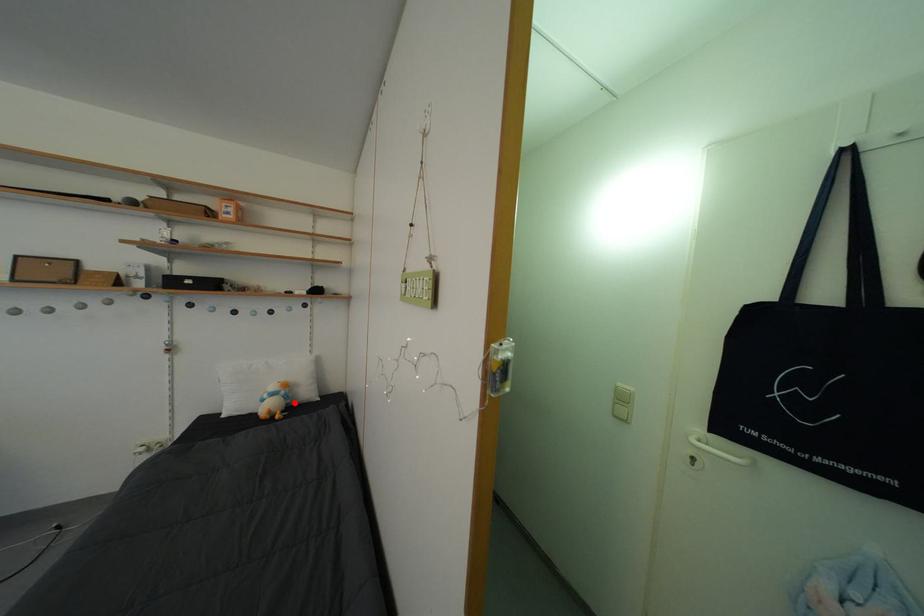
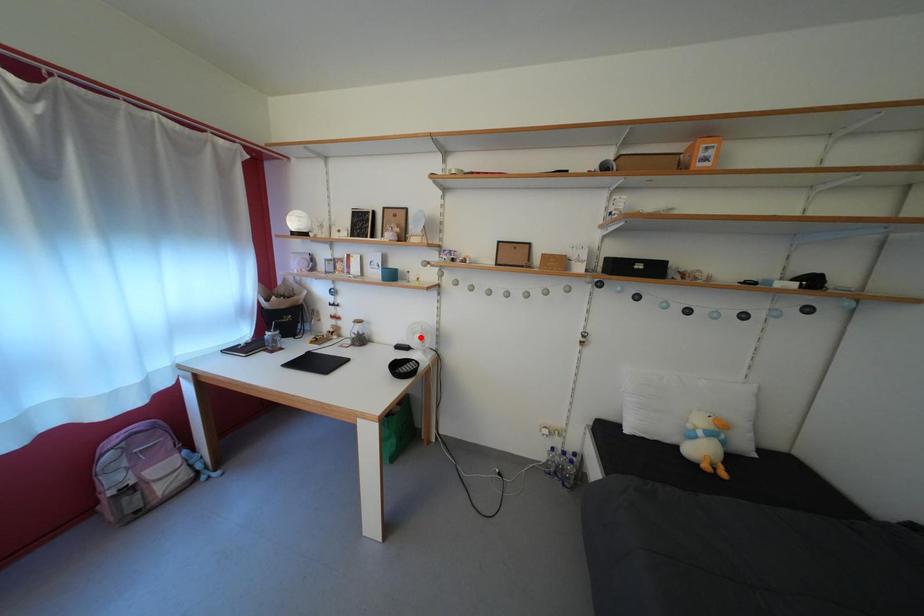
I am providing you with two images of the same scene from different viewpoints. A red point is marked on the first image and another point is marked on the second image. Do the highlighted points in image1 and image2 indicate the same real-world spot?

No